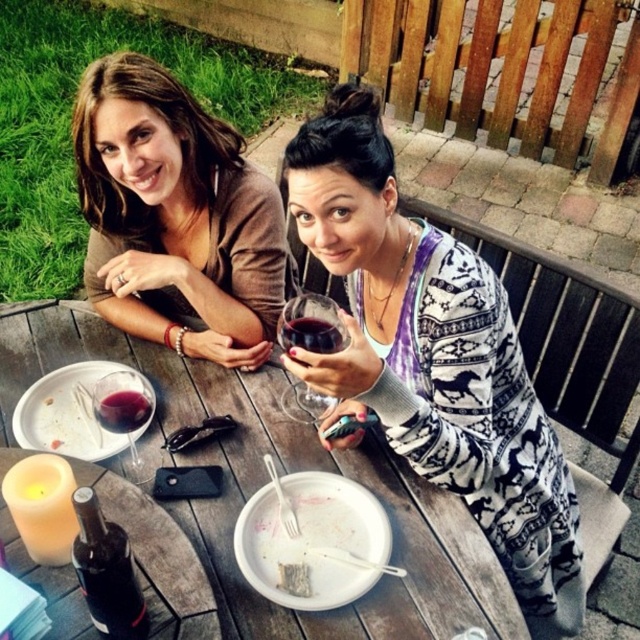
Who is positioned more to the left, white printed sweater at center or transparent glass at table center?

transparent glass at table center is more to the left.

Which is behind, point (550, 513) or point (116, 378)?

Point (550, 513)

Describe the element at coordinates (435, 356) in the screenshot. This screenshot has width=640, height=640. I see `white printed sweater at center` at that location.

Identify the location of white printed sweater at center. pos(435,356).

Who is shorter, ruby glass wine at table center or white crumbly bread at lower center?

Standing shorter between the two is white crumbly bread at lower center.

Is ruby glass wine at table center bigger than white crumbly bread at lower center?

Yes, ruby glass wine at table center is bigger than white crumbly bread at lower center.

Between point (141, 410) and point (282, 566), which one is positioned in front?

Point (282, 566)

You are a GUI agent. You are given a task and a screenshot of the screen. Output one action in this format:
    pyautogui.click(x=<x>, y=<y>)
    Task: Click on the ruby glass wine at table center
    The image size is (640, 640).
    Given the screenshot: What is the action you would take?
    pyautogui.click(x=122, y=410)

Who is more distant from viewer, (225, 589) or (97, 541)?

The point (225, 589) is more distant.

Who is positioned more to the left, wooden table at center or dark brown glass bottle at lower left?

From the viewer's perspective, dark brown glass bottle at lower left appears more on the left side.

Does point (237, 618) lie in front of point (104, 604)?

No, (237, 618) is behind (104, 604).

This screenshot has width=640, height=640. I want to click on wooden table at center, so click(x=266, y=481).